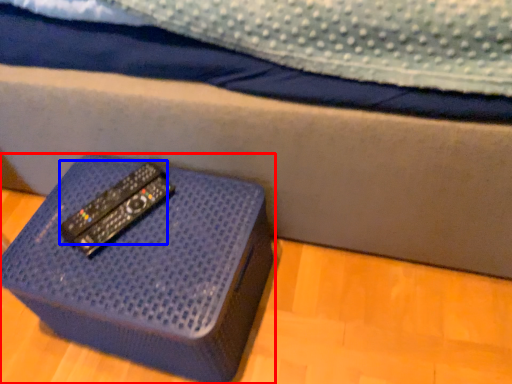
Question: Among these objects, which one is farthest to the camera, furniture (highlighted by a red box) or remote (highlighted by a blue box)?

Choices:
 (A) furniture
 (B) remote

Answer: (B)